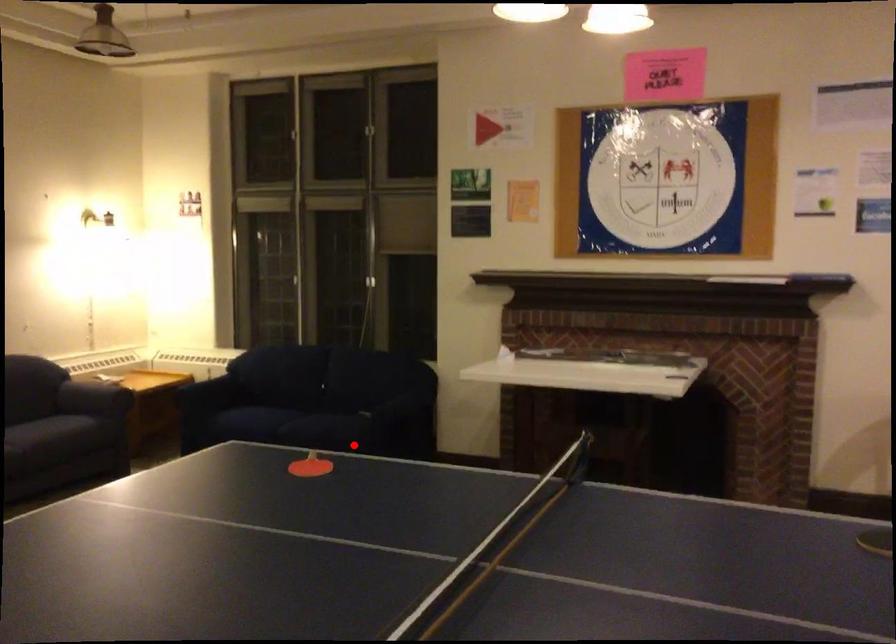
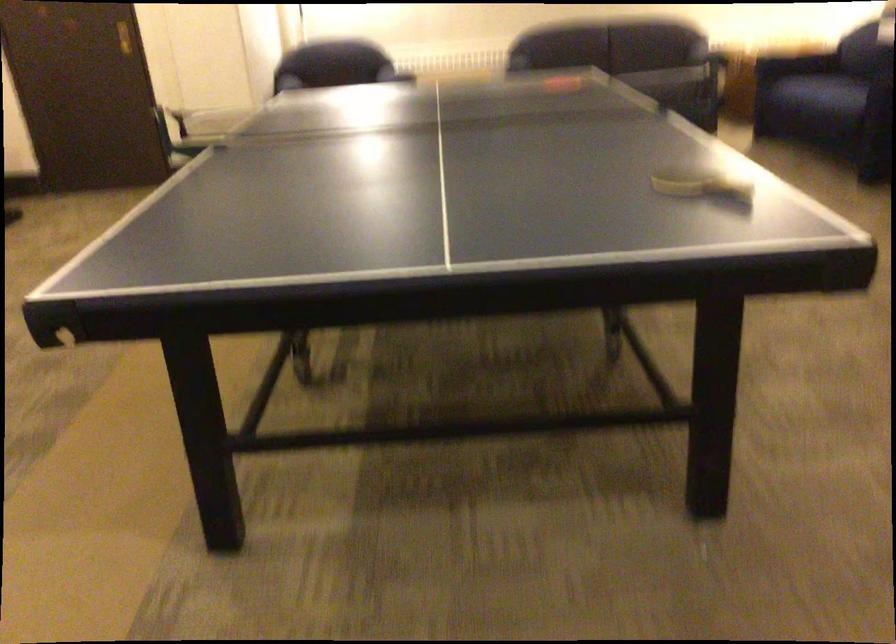
Where in the second image is the point corresponding to the highlighted location from the first image?

(819, 105)